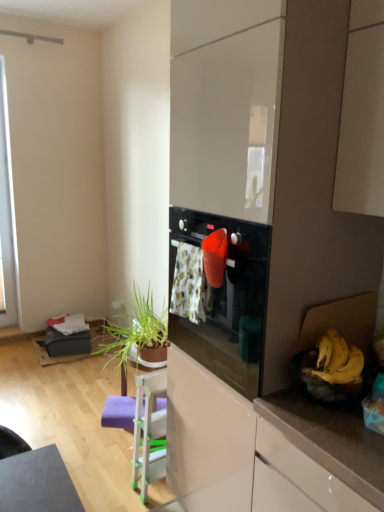
Where is `free space to the left of white plastic chair at lower center`? The height and width of the screenshot is (512, 384). free space to the left of white plastic chair at lower center is located at coordinates (115, 486).